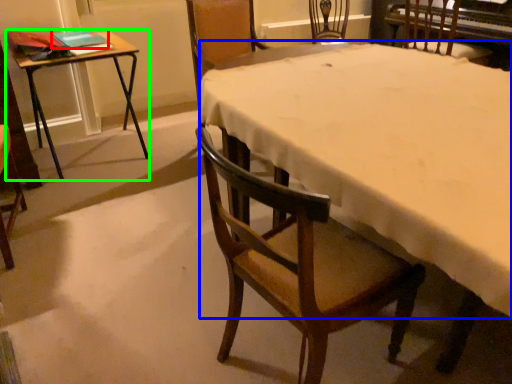
Question: Which object is the farthest from book (highlighted by a red box)? Choose among these: tablecloth (highlighted by a blue box) or table (highlighted by a green box).

Choices:
 (A) tablecloth
 (B) table

Answer: (A)